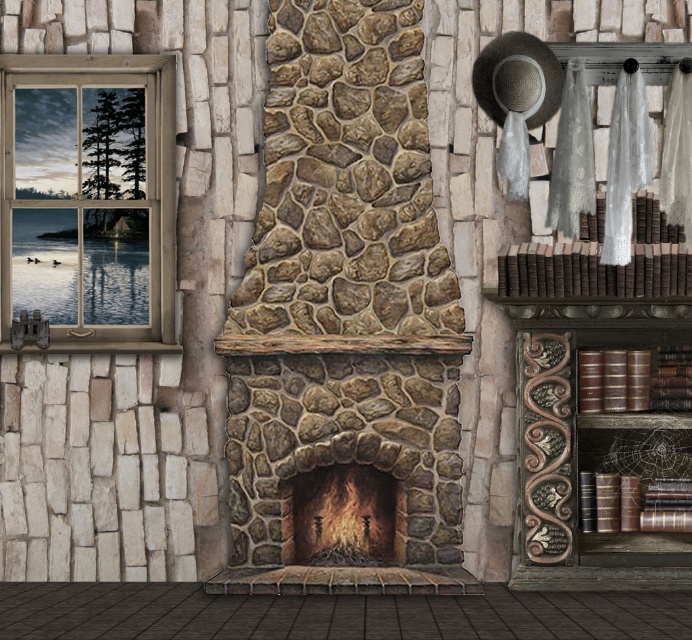
At what (x,y) coordinates should I click in order to perform the action: click on wooden frame window at left. Please return your answer as a coordinate pair (x, y). The height and width of the screenshot is (640, 692). Looking at the image, I should click on (86, 202).

Is wooden frame window at left wider than rustic stone fireplace at center?

Indeed, wooden frame window at left has a greater width compared to rustic stone fireplace at center.

Between point (102, 76) and point (307, 508), which one is positioned behind?

Positioned behind is point (102, 76).

Identify the location of wooden frame window at left. (86, 202).